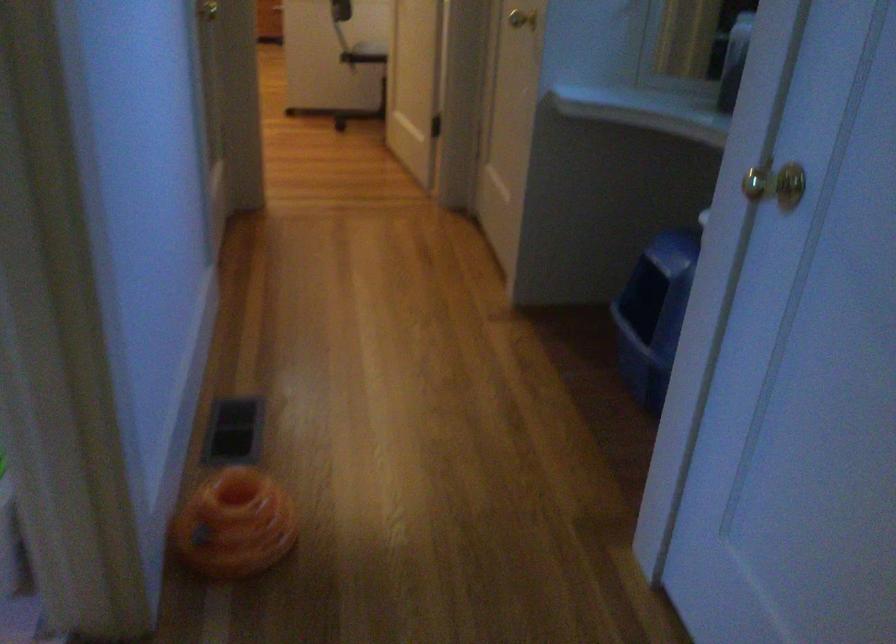
Where would you push the orange cat toy? Please return your answer as a coordinate pair (x, y).

(235, 524)